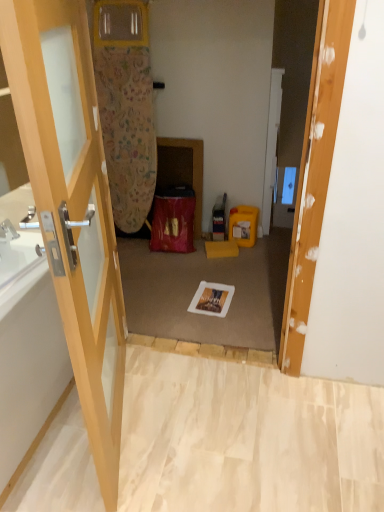
Question: Does white glossy bathtub at left lie behind yellow plastic box at center-right?

Choices:
 (A) yes
 (B) no

Answer: (B)

Question: From a real-world perspective, is white glossy bathtub at left on top of yellow plastic box at center-right?

Choices:
 (A) yes
 (B) no

Answer: (A)

Question: Considering the relative sizes of white glossy bathtub at left and yellow plastic box at center-right in the image provided, is white glossy bathtub at left bigger than yellow plastic box at center-right?

Choices:
 (A) no
 (B) yes

Answer: (B)

Question: Considering the relative sizes of white glossy bathtub at left and yellow plastic box at center-right in the image provided, is white glossy bathtub at left thinner than yellow plastic box at center-right?

Choices:
 (A) no
 (B) yes

Answer: (A)

Question: Is white glossy bathtub at left shorter than yellow plastic box at center-right?

Choices:
 (A) yes
 (B) no

Answer: (B)

Question: Does white glossy bathtub at left turn towards yellow plastic box at center-right?

Choices:
 (A) yes
 (B) no

Answer: (B)

Question: From the image's perspective, does yellow plastic box at center-right appear higher than white glossy bathtub at left?

Choices:
 (A) yes
 (B) no

Answer: (A)

Question: From a real-world perspective, is yellow plastic box at center-right positioned under white glossy bathtub at left based on gravity?

Choices:
 (A) yes
 (B) no

Answer: (A)

Question: Considering the relative sizes of yellow plastic box at center-right and white glossy bathtub at left in the image provided, is yellow plastic box at center-right shorter than white glossy bathtub at left?

Choices:
 (A) no
 (B) yes

Answer: (B)

Question: Is yellow plastic box at center-right facing away from white glossy bathtub at left?

Choices:
 (A) no
 (B) yes

Answer: (A)

Question: Is yellow plastic box at center-right wider than white glossy bathtub at left?

Choices:
 (A) yes
 (B) no

Answer: (B)

Question: From a real-world perspective, is yellow plastic box at center-right positioned over white glossy bathtub at left based on gravity?

Choices:
 (A) yes
 (B) no

Answer: (B)

Question: Can you confirm if yellow plastic box at center-right is thinner than white glossy door at center, acting as the 1th door starting from the back?

Choices:
 (A) yes
 (B) no

Answer: (B)